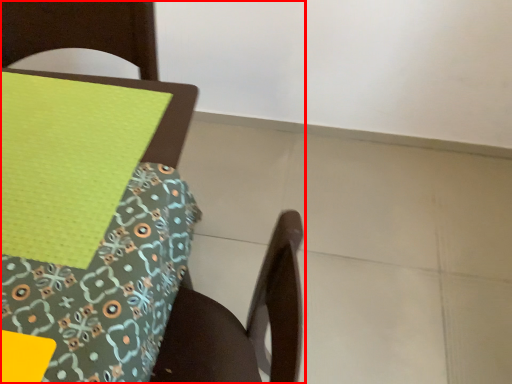
Question: In this image, where is chair (annotated by the red box) located relative to sheet?

Choices:
 (A) right
 (B) left

Answer: (A)